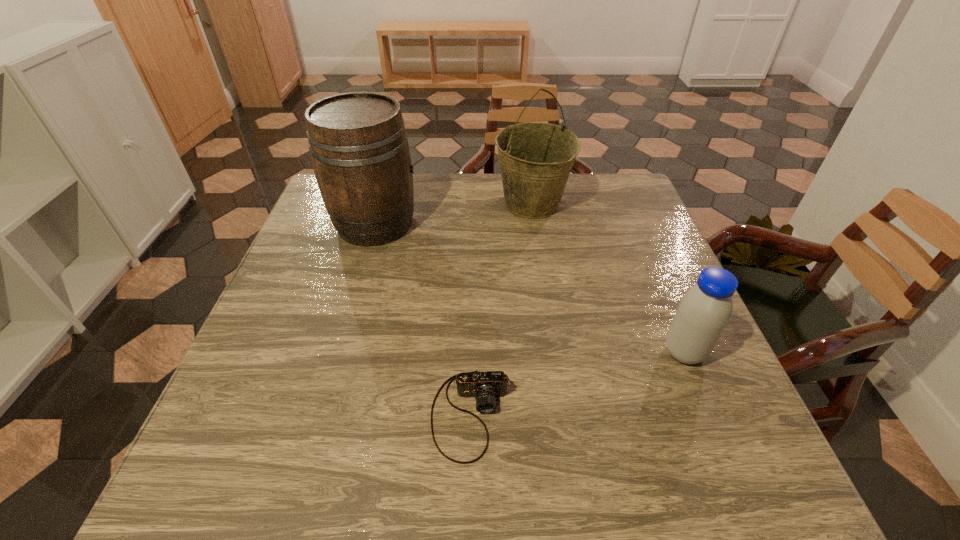
Find the location of a particular element. the closest object to the soya milk is located at coordinates (485, 386).

Image resolution: width=960 pixels, height=540 pixels. Find the location of `object that ranks as the third closest to the rightmost object`. object that ranks as the third closest to the rightmost object is located at coordinates (358, 144).

The height and width of the screenshot is (540, 960). I want to click on free location that satisfies the following two spatial constraints: 1. on the front side of the wine bucket; 2. on the side of the leftmost object near the bung hole, so click(535, 224).

Identify the location of blank space that satisfies the following two spatial constraints: 1. on the side of the second nearest object near the bung hole; 2. on the right side of the leftmost object. (338, 352).

Find the location of a particular element. The height and width of the screenshot is (540, 960). free space in the image that satisfies the following two spatial constraints: 1. on the back side of the rightmost object; 2. on the side of the cider near the bung hole is located at coordinates (631, 224).